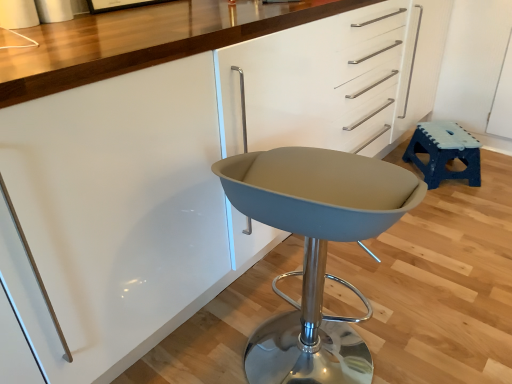
The image size is (512, 384). I want to click on blue plastic stool at right, so click(444, 152).

What is the approximate height of blue plastic stool at right?

blue plastic stool at right is 21.93 centimeters in height.

The image size is (512, 384). Describe the element at coordinates (444, 152) in the screenshot. I see `blue plastic stool at right` at that location.

This screenshot has height=384, width=512. Describe the element at coordinates (315, 249) in the screenshot. I see `matte gray swivel chair at center` at that location.

You are a GUI agent. You are given a task and a screenshot of the screen. Output one action in this format:
    pyautogui.click(x=<x>, y=<y>)
    Task: Click on the matte gray swivel chair at center
    The height and width of the screenshot is (384, 512).
    Given the screenshot: What is the action you would take?
    pyautogui.click(x=315, y=249)

Locate an element on the screen. blue plastic stool at right is located at coordinates (444, 152).

Can you confirm if matte gray swivel chair at center is positioned to the right of blue plastic stool at right?

Incorrect, matte gray swivel chair at center is not on the right side of blue plastic stool at right.

Does matte gray swivel chair at center come behind blue plastic stool at right?

No, the depth of matte gray swivel chair at center is less than that of blue plastic stool at right.

Between point (314, 152) and point (474, 178), which one is positioned in front?

Point (314, 152)

From the picture: From the image's perspective, would you say matte gray swivel chair at center is shown under blue plastic stool at right?

Yes.

Looking at this image, from a real-world perspective, between matte gray swivel chair at center and blue plastic stool at right, who is vertically lower?

In real-world perspective, blue plastic stool at right is lower.

Can you confirm if matte gray swivel chair at center is wider than blue plastic stool at right?

Indeed, matte gray swivel chair at center has a greater width compared to blue plastic stool at right.

Is matte gray swivel chair at center shorter than blue plastic stool at right?

No, matte gray swivel chair at center is not shorter than blue plastic stool at right.

Based on their sizes in the image, would you say matte gray swivel chair at center is bigger or smaller than blue plastic stool at right?

Clearly, matte gray swivel chair at center is larger in size than blue plastic stool at right.

Based on the photo, is matte gray swivel chair at center situated inside blue plastic stool at right or outside?

matte gray swivel chair at center exists outside the volume of blue plastic stool at right.

Are matte gray swivel chair at center and blue plastic stool at right far apart?

Yes, matte gray swivel chair at center and blue plastic stool at right are quite far apart.

Is matte gray swivel chair at center oriented towards blue plastic stool at right?

Yes, matte gray swivel chair at center is oriented towards blue plastic stool at right.

What's the angular difference between matte gray swivel chair at center and blue plastic stool at right's facing directions?

The facing directions of matte gray swivel chair at center and blue plastic stool at right are 147 degrees apart.

You are a GUI agent. You are given a task and a screenshot of the screen. Output one action in this format:
    pyautogui.click(x=<x>, y=<y>)
    Task: Click on the stool on the right of matte gray swivel chair at center
    This screenshot has height=384, width=512.
    Given the screenshot: What is the action you would take?
    pyautogui.click(x=444, y=152)

Is blue plastic stool at right at the right side of matte gray swivel chair at center?

Indeed, blue plastic stool at right is positioned on the right side of matte gray swivel chair at center.

Considering the positions of objects blue plastic stool at right and matte gray swivel chair at center in the image provided, who is behind, blue plastic stool at right or matte gray swivel chair at center?

blue plastic stool at right is more distant.

Does point (423, 144) come in front of point (352, 171)?

No, it is behind (352, 171).

From the image's perspective, which object appears higher, blue plastic stool at right or matte gray swivel chair at center?

blue plastic stool at right is shown above in the image.

From a real-world perspective, who is located lower, blue plastic stool at right or matte gray swivel chair at center?

blue plastic stool at right is physically lower.

Based on the photo, between blue plastic stool at right and matte gray swivel chair at center, which one has larger width?

matte gray swivel chair at center.

Who is taller, blue plastic stool at right or matte gray swivel chair at center?

matte gray swivel chair at center is taller.

Who is bigger, blue plastic stool at right or matte gray swivel chair at center?

matte gray swivel chair at center is bigger.

Is blue plastic stool at right spatially inside matte gray swivel chair at center, or outside of it?

blue plastic stool at right is located beyond the bounds of matte gray swivel chair at center.

Is blue plastic stool at right far from matte gray swivel chair at center?

Yes.

Could you tell me if blue plastic stool at right is turned towards matte gray swivel chair at center?

No, blue plastic stool at right is not aimed at matte gray swivel chair at center.

How different are the orientations of blue plastic stool at right and matte gray swivel chair at center in degrees?

There is a 147-degree angle between the facing directions of blue plastic stool at right and matte gray swivel chair at center.

Where is `swivel chair below the blue plastic stool at right (from the image's perspective)`? The image size is (512, 384). swivel chair below the blue plastic stool at right (from the image's perspective) is located at coordinates pos(315,249).

Where is `stool on the right of matte gray swivel chair at center`? stool on the right of matte gray swivel chair at center is located at coordinates (444, 152).

You are a GUI agent. You are given a task and a screenshot of the screen. Output one action in this format:
    pyautogui.click(x=<x>, y=<y>)
    Task: Click on the stool behind the matte gray swivel chair at center
    This screenshot has width=512, height=384.
    Given the screenshot: What is the action you would take?
    pyautogui.click(x=444, y=152)